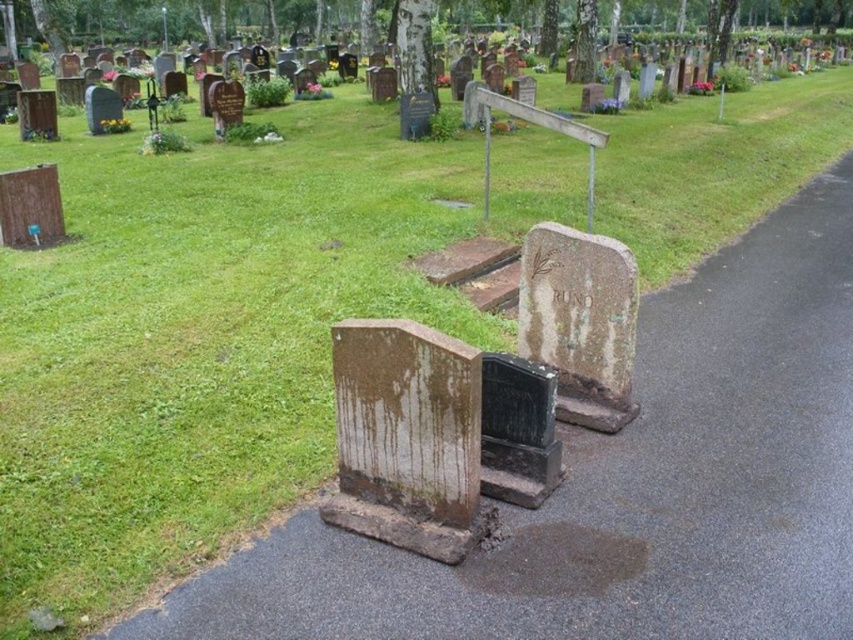
You are standing at the entrance of the cemetery and want to locate the bronze textured gravestone at center. According to the coordinates provided, where should you look relative to your current position?

The bronze textured gravestone at center is located at coordinates point (x=579, y=321), which is directly ahead and slightly to the right of your current position at the entrance.

You are a groundskeeper assessing the cemetery layout. You notice the bronze textured gravestone at center and the black stone gravestone at center. Which one is higher in height?

The bronze textured gravestone at center is taller than the black stone gravestone at center.

You are visiting a cemetery and want to place a bouquet of flowers between the brown stone gravestone at center and the black stone gravestone at center. Which gravestone should you place the bouquet closer to if you want it to be more visible from the pathway?

You should place the bouquet closer to the brown stone gravestone at center because it is much taller than the black stone gravestone at center, making it more prominent and visible from the pathway.